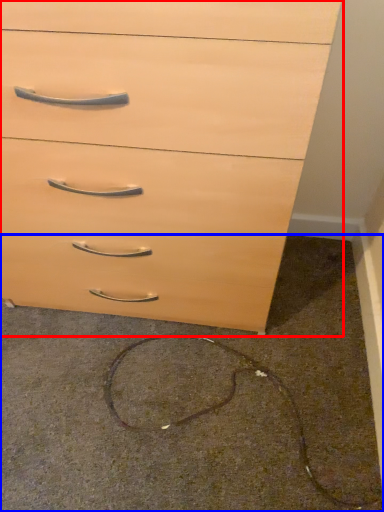
Question: Which of the following is the closest to the observer, chest of drawers (highlighted by a red box) or concrete (highlighted by a blue box)?

Choices:
 (A) chest of drawers
 (B) concrete

Answer: (A)